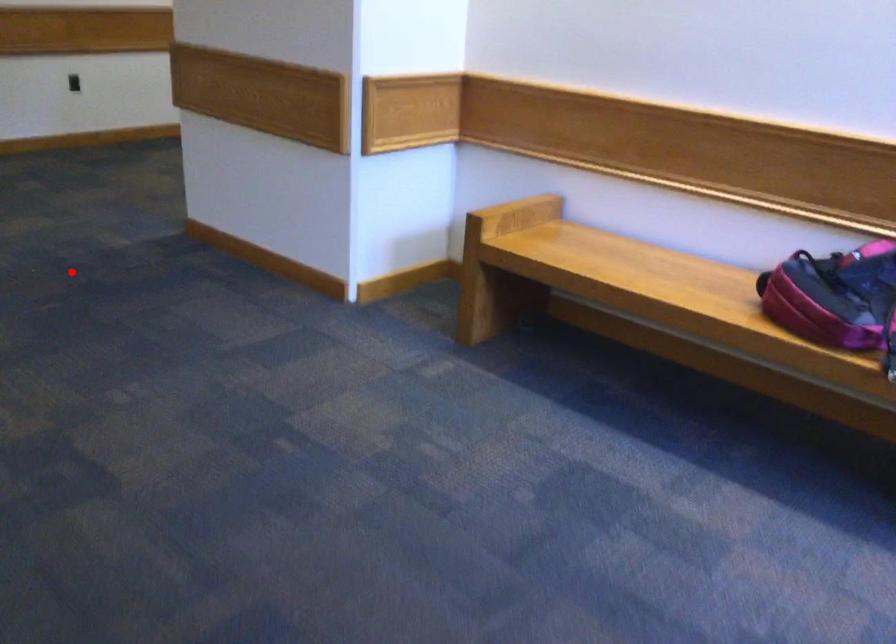
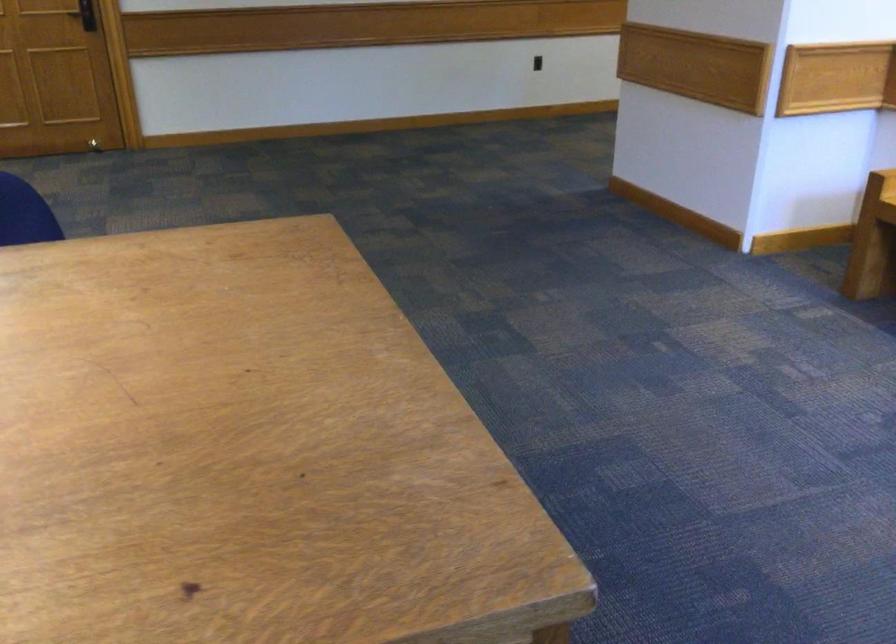
Locate, in the second image, the point that corresponds to the highlighted location in the first image.

(515, 214)